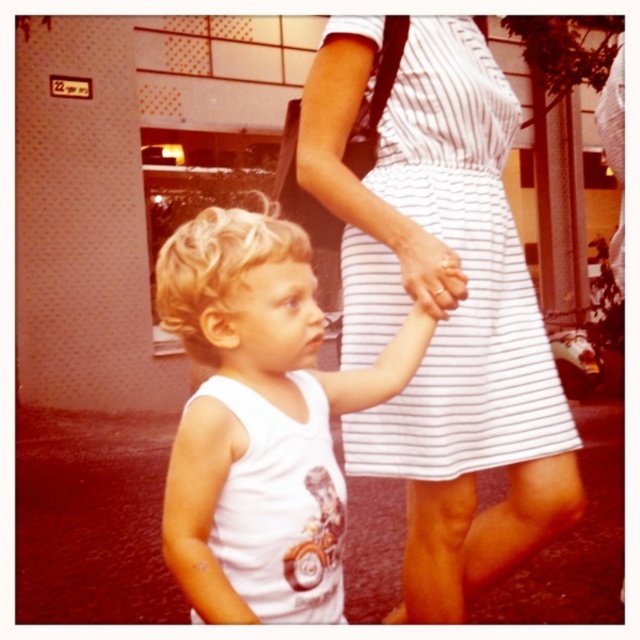
Between white striped dress at center and white matte tank top at center, which one has more height?

white striped dress at center is taller.

Does point (460, 58) come closer to viewer compared to point (179, 259)?

No, (460, 58) is behind (179, 259).

Identify the location of white striped dress at center. (461, 272).

Between white striped dress at center and white matte hand at center, which one has more height?

Standing taller between the two is white striped dress at center.

Does white striped dress at center appear over white matte hand at center?

Indeed, white striped dress at center is positioned over white matte hand at center.

Does point (436, 326) come behind point (413, 278)?

Yes, it is.

Where is `white striped dress at center`? white striped dress at center is located at coordinates (461, 272).

Can you confirm if white matte tank top at center is positioned above white matte hand at center?

No, white matte tank top at center is not above white matte hand at center.

Is white matte tank top at center below white matte hand at center?

Yes, white matte tank top at center is below white matte hand at center.

Describe the element at coordinates (269, 406) in the screenshot. I see `white matte tank top at center` at that location.

This screenshot has height=640, width=640. Find the location of `white matte tank top at center`. white matte tank top at center is located at coordinates (269, 406).